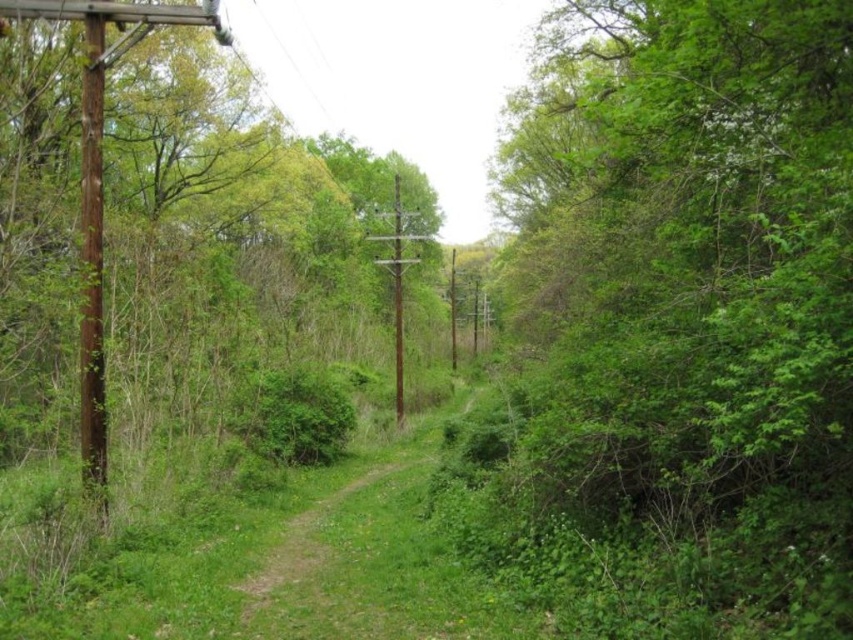
You are a hiker walking along the narrow dirt path in the image. You notice a green leafy tree at left and a brown wooden telegraph pole at center. Which object is closer to the path?

The green leafy tree at left is closer to the path than the brown wooden telegraph pole at center because it is smaller in size. Smaller objects in the foreground appear closer than larger ones in the background.

You are a hiker navigating a narrow dirt path through a forest. You notice a green leafy bush at right and a brown wooden telegraph pole at center. Which object would block your view more if you were standing on the path?

The green leafy bush at right would block your view more because it is larger in size than the brown wooden telegraph pole at center.